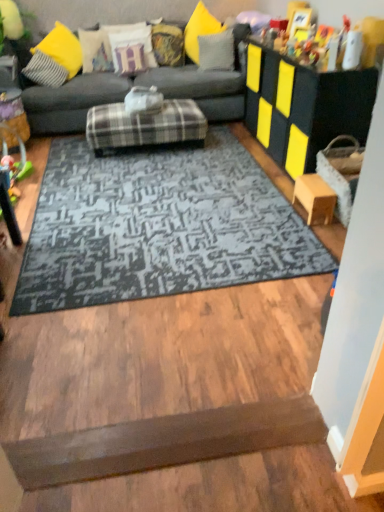
Question: Do you think wooden table at right, marked as the second table in a top-to-bottom arrangement, is within plastic green toy at left, or outside of it?

Choices:
 (A) inside
 (B) outside

Answer: (B)

Question: From a real-world perspective, is wooden table at right, placed as the 1th table when sorted from bottom to top, physically located above or below plastic green toy at left?

Choices:
 (A) above
 (B) below

Answer: (A)

Question: Based on their relative distances, which object is nearer to the plastic green toy at left?

Choices:
 (A) wooden stool at lower right
 (B) textured fabric pillow at upper center, positioned as the fourth pillow in left-to-right order
 (C) yellow fabric pillow at upper center, which ranks as the second pillow in right-to-left order
 (D) plaid fabric ottoman at center
 (E) velvet white pillow at upper center, the third pillow when ordered from left to right

Answer: (D)

Question: Which of these objects is positioned farthest from the yellow fabric pillow at upper center, which ranks as the second pillow in right-to-left order?

Choices:
 (A) plaid fabric ottoman at center
 (B) textured cream pillow at upper left, placed as the 6th pillow when sorted from right to left
 (C) plastic green toy at left
 (D) dark gray textured rug at center
 (E) velvet white pillow at upper center, the third pillow when ordered from left to right

Answer: (C)